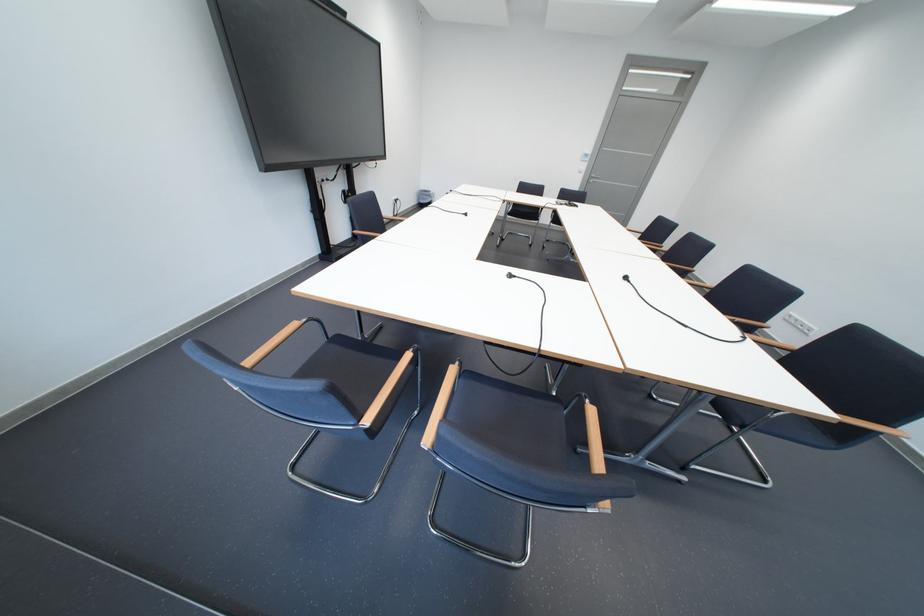
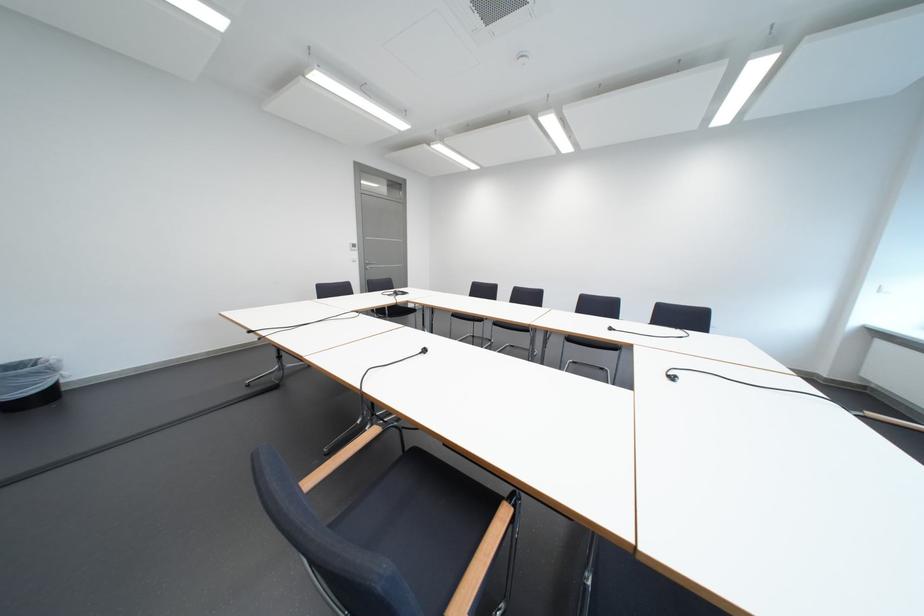
In the second image, find the point that corresponds to point (439, 195) in the first image.

(23, 373)